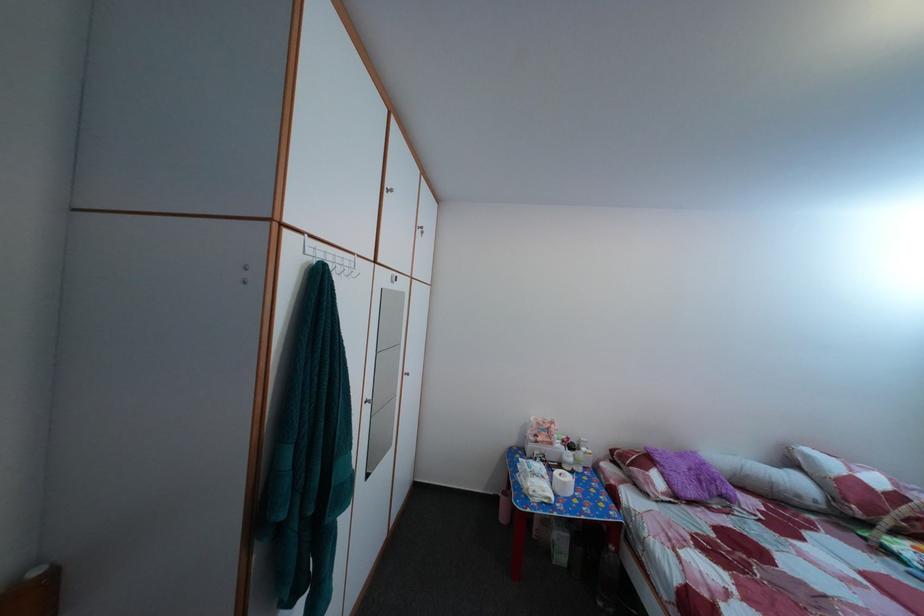
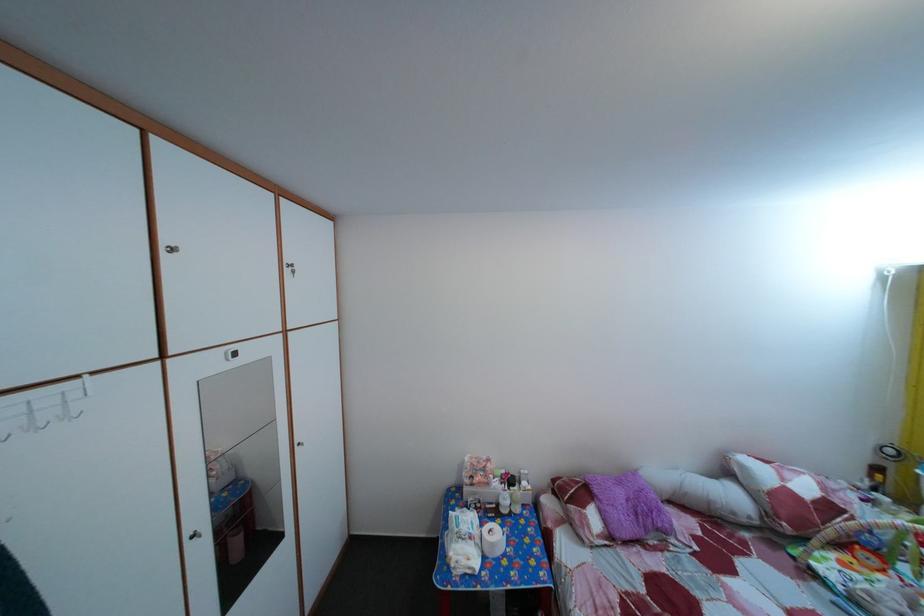
The point at [432,240] is marked in the first image. Where is the corresponding point in the second image?

(304, 280)